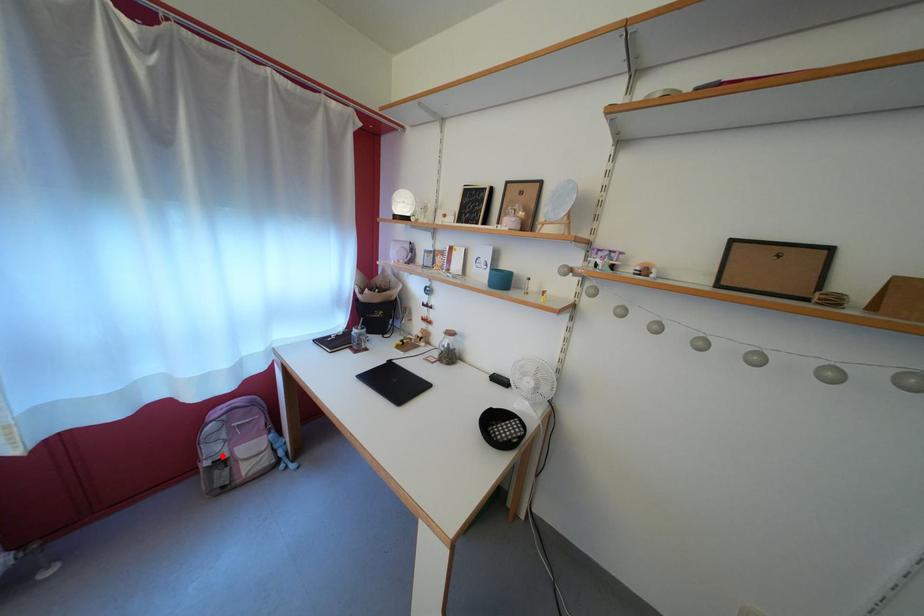
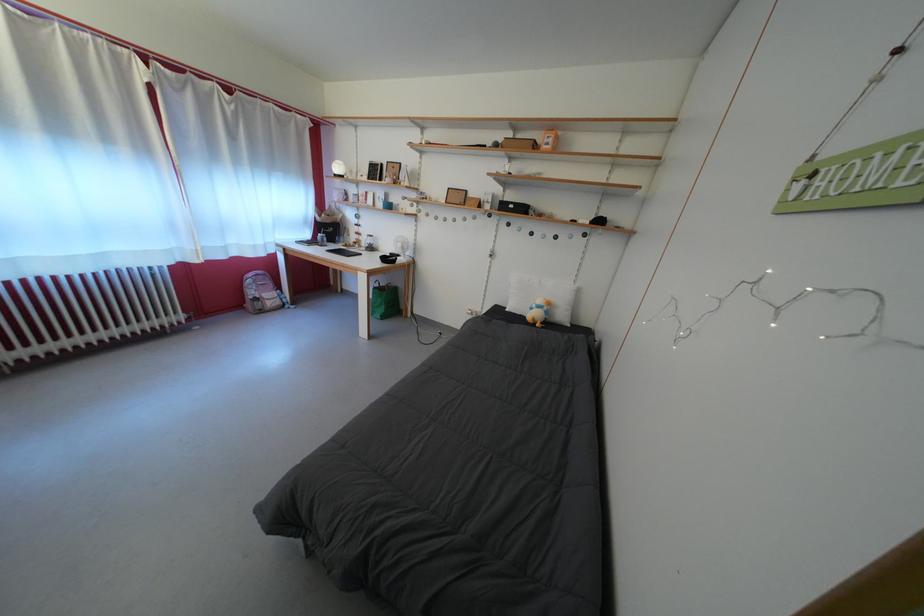
Question: I am providing you with two images of the same scene from different viewpoints. A red point is shown in image1. For the corresponding object point in image2, is it positioned nearer or farther from the camera?

Choices:
 (A) Nearer
 (B) Farther

Answer: (A)